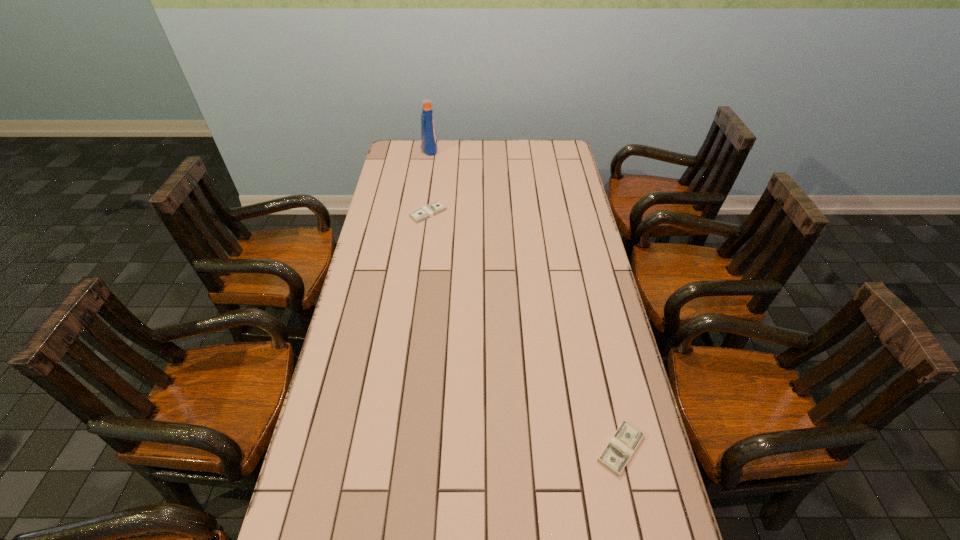
The width and height of the screenshot is (960, 540). I want to click on detergent at the left edge, so click(x=428, y=136).

The height and width of the screenshot is (540, 960). Identify the location of dollar positioned at the left edge. [432, 209].

The image size is (960, 540). Identify the location of object that is at the right edge. (623, 443).

Where is `object situated at the far left corner`? object situated at the far left corner is located at coordinates (428, 136).

The image size is (960, 540). Identify the location of vacant space at the far edge of the desktop. (470, 149).

This screenshot has height=540, width=960. Find the location of `free location at the left edge of the desktop`. free location at the left edge of the desktop is located at coordinates [391, 303].

Identify the location of vacant space at the right edge. This screenshot has height=540, width=960. (578, 191).

Locate an element on the screen. vacant space at the far left corner of the desktop is located at coordinates (413, 143).

The height and width of the screenshot is (540, 960). Find the location of `free space at the far right corner of the desktop`. free space at the far right corner of the desktop is located at coordinates (550, 152).

Locate an element on the screen. The width and height of the screenshot is (960, 540). unoccupied area between the farthest object and the second nearest object is located at coordinates (429, 181).